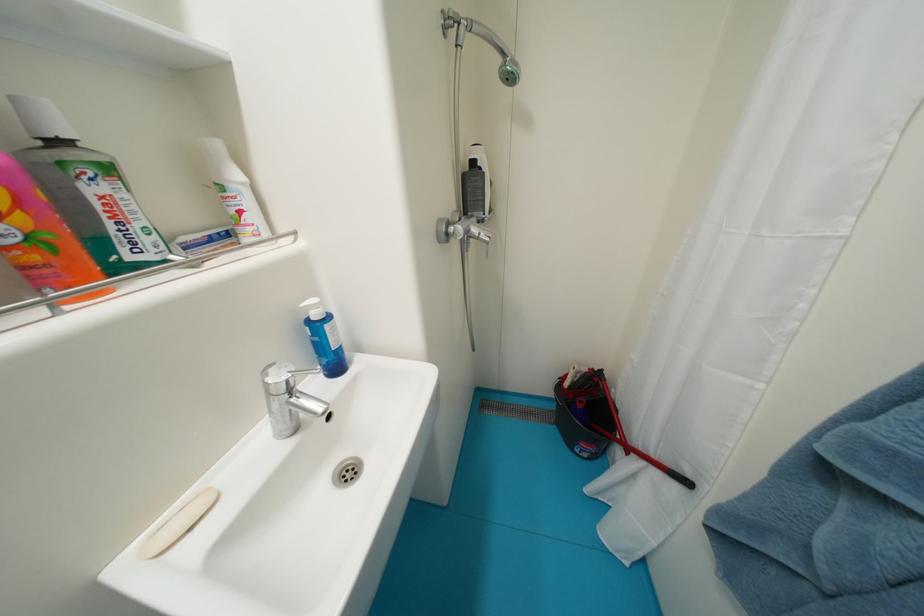
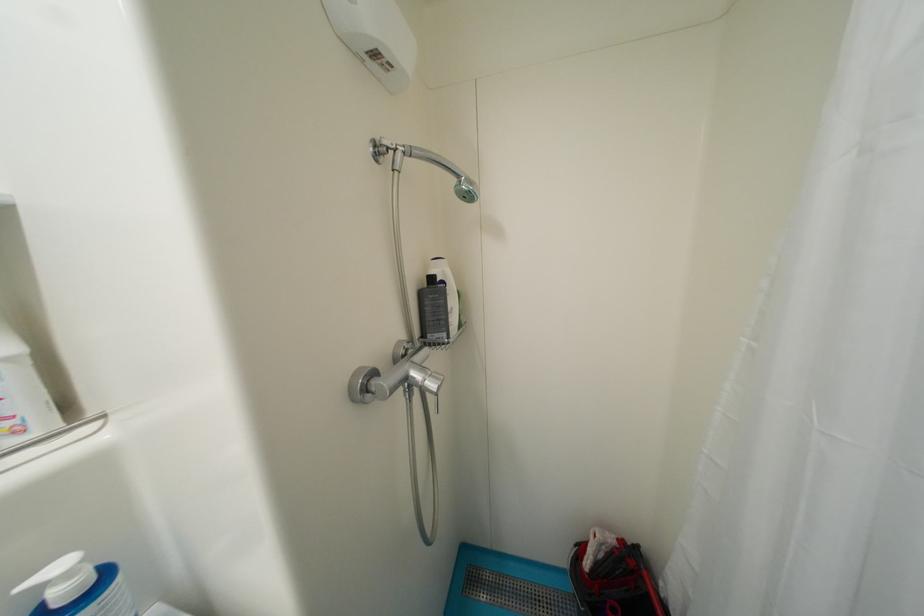
Locate, in the second image, the point that corresponds to [480,164] in the first image.

(439, 281)